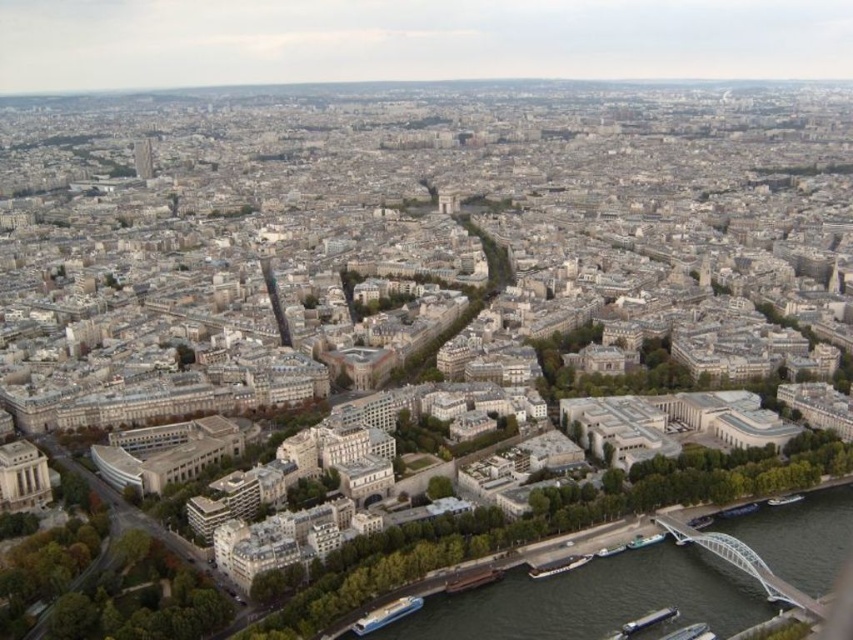
Between dark gray concrete river at lower right and smooth concrete tower at upper left, which one has less height?

Standing shorter between the two is dark gray concrete river at lower right.

Between dark gray concrete river at lower right and smooth concrete tower at upper left, which one is positioned lower?

Positioned lower is dark gray concrete river at lower right.

Which is in front, point (439, 611) or point (149, 148)?

Positioned in front is point (439, 611).

Where is `dark gray concrete river at lower right`? This screenshot has width=853, height=640. dark gray concrete river at lower right is located at coordinates (592, 600).

Which is behind, point (668, 596) or point (267, 282)?

The point (267, 282) is more distant.

Locate an element on the screen. This screenshot has width=853, height=640. dark gray concrete river at lower right is located at coordinates (592, 600).

Does shiny metallic tower at center appear on the left side of smooth concrete tower at upper left?

No, shiny metallic tower at center is not to the left of smooth concrete tower at upper left.

Who is more distant from viewer, (x=287, y=324) or (x=148, y=157)?

Point (x=148, y=157)

The width and height of the screenshot is (853, 640). What are the coordinates of `shiny metallic tower at center` in the screenshot? It's located at (276, 301).